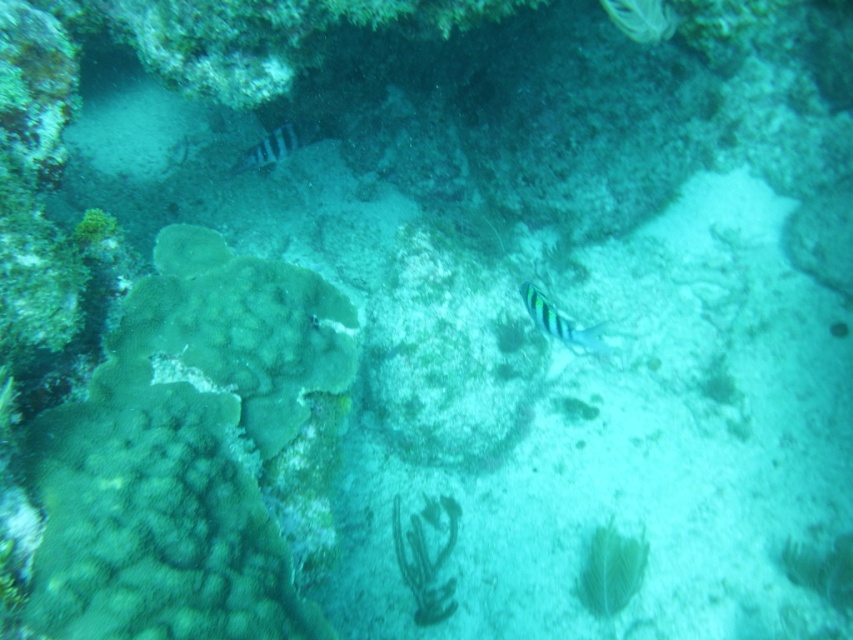
You are a marine biologist studying underwater life. You have a map showing a point at coordinates (x=560, y=323). According to the image, what is located at that point?

The point at coordinates (x=560, y=323) is on a striped matte fish at center.